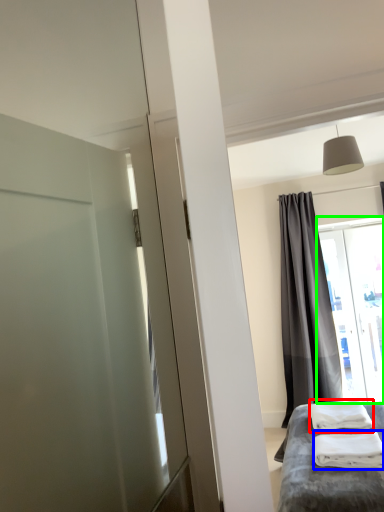
Question: Based on their relative distances, which object is nearer to bath towel (highlighted by a red box)? Choose from material (highlighted by a blue box) and window (highlighted by a green box).

Choices:
 (A) material
 (B) window

Answer: (A)